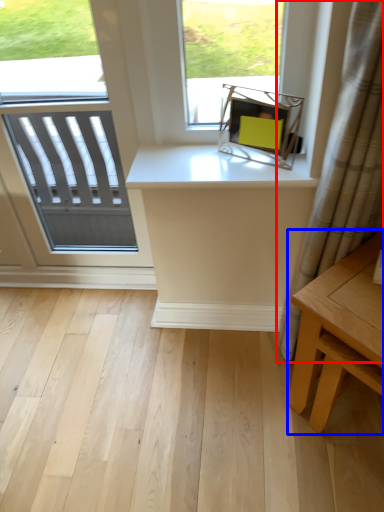
Question: Which object is further to the camera taking this photo, curtain (highlighted by a red box) or table (highlighted by a blue box)?

Choices:
 (A) curtain
 (B) table

Answer: (B)